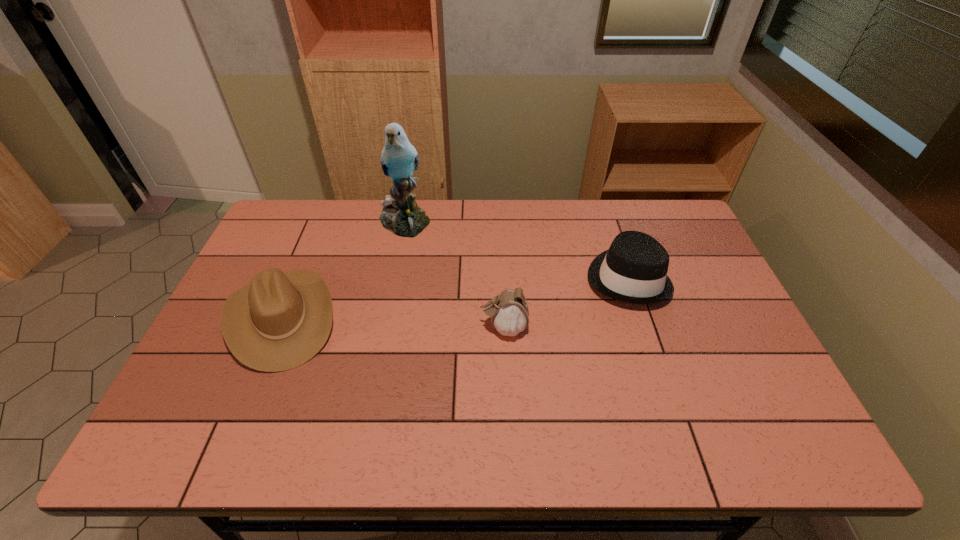
I want to click on vacant space located on the right of the leftmost object, so click(x=385, y=318).

Where is `object located in the far edge section of the desktop`? Image resolution: width=960 pixels, height=540 pixels. object located in the far edge section of the desktop is located at coordinates (401, 215).

At what (x,y) coordinates should I click in order to perform the action: click on object that is at the left edge. Please return your answer as a coordinate pair (x, y). Looking at the image, I should click on (281, 320).

What are the coordinates of `object at the right edge` in the screenshot? It's located at (634, 269).

Image resolution: width=960 pixels, height=540 pixels. In order to click on free space at the far edge of the desktop in this screenshot , I will do `click(378, 222)`.

In the image, there is a desktop. What are the coordinates of `free region at the near edge` in the screenshot? It's located at (492, 433).

Find the location of `vacant space at the left edge of the desktop`. vacant space at the left edge of the desktop is located at coordinates (240, 281).

In the image, there is a desktop. What are the coordinates of `free space at the right edge` in the screenshot? It's located at (683, 322).

Locate an element on the screen. vacant space at the near right corner is located at coordinates [x=759, y=440].

Locate an element on the screen. The image size is (960, 540). vacant point located between the cowboy hat and the fedora is located at coordinates (454, 298).